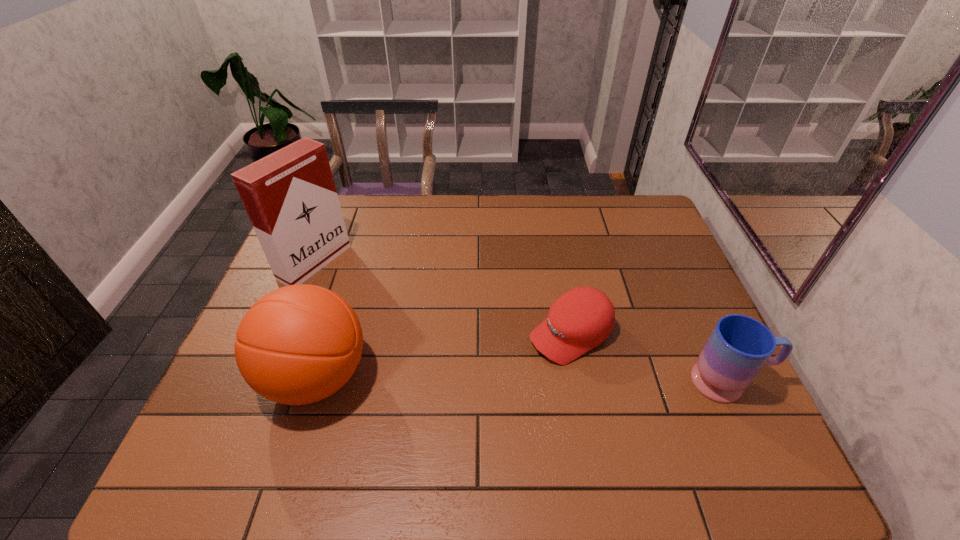
Locate an element on the screen. The image size is (960, 540). the third shortest object is located at coordinates (298, 344).

What are the coordinates of `the third tallest object` in the screenshot? It's located at (739, 346).

The height and width of the screenshot is (540, 960). Identify the location of the rightmost object. 739,346.

The image size is (960, 540). I want to click on the shortest object, so click(x=582, y=318).

Where is `the second object from right to left`? Image resolution: width=960 pixels, height=540 pixels. the second object from right to left is located at coordinates (582, 318).

This screenshot has width=960, height=540. What are the coordinates of `the tallest object` in the screenshot? It's located at (290, 197).

Image resolution: width=960 pixels, height=540 pixels. I want to click on the farthest object, so click(290, 197).

Where is `vacant space located on the left of the basketball`? Image resolution: width=960 pixels, height=540 pixels. vacant space located on the left of the basketball is located at coordinates (229, 377).

Find the location of a particular element. free region located on the front-facing side of the shortest object is located at coordinates (476, 388).

Locate an element on the screen. vacant point located 0.360m on the front-facing side of the shortest object is located at coordinates (414, 426).